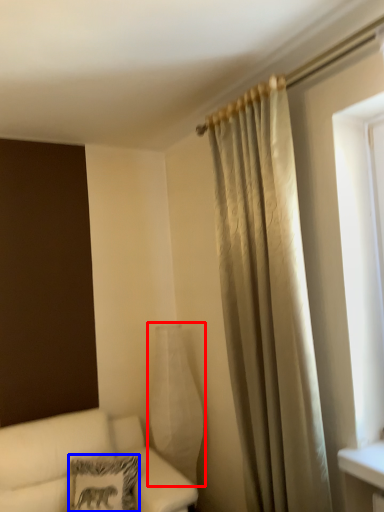
Question: Which object is closer to the camera taking this photo, glass vase (highlighted by a red box) or pillow (highlighted by a blue box)?

Choices:
 (A) glass vase
 (B) pillow

Answer: (B)